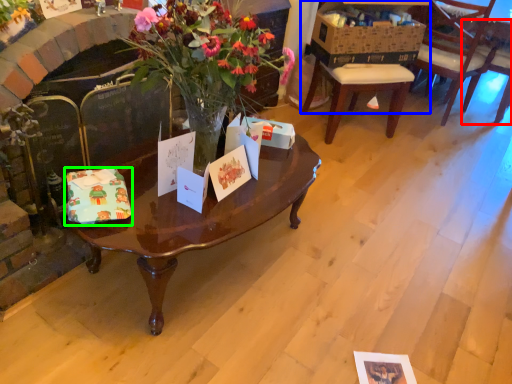
Question: Which object is positioned farthest from chair (highlighted by a red box)? Select from desk (highlighted by a blue box) and gift card (highlighted by a green box).

Choices:
 (A) desk
 (B) gift card

Answer: (B)